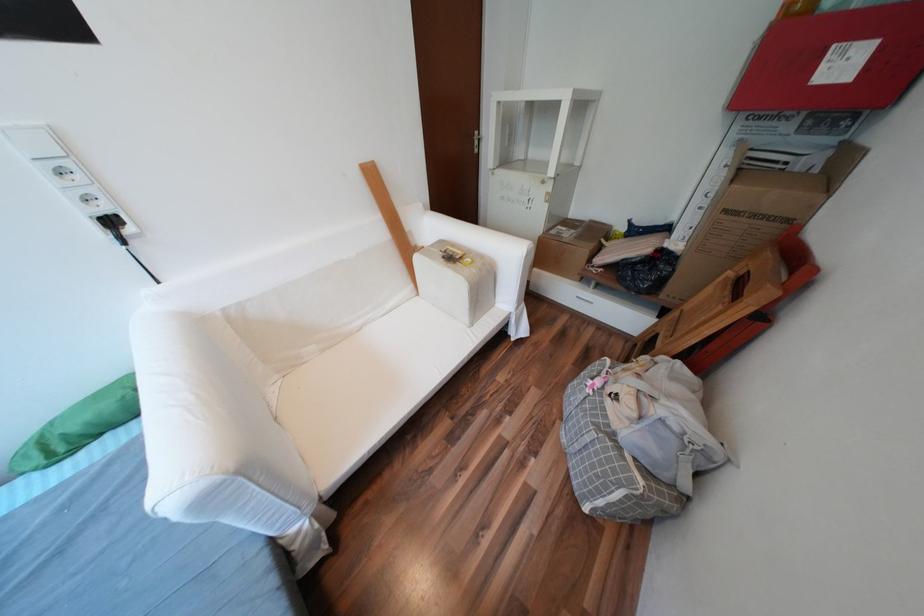
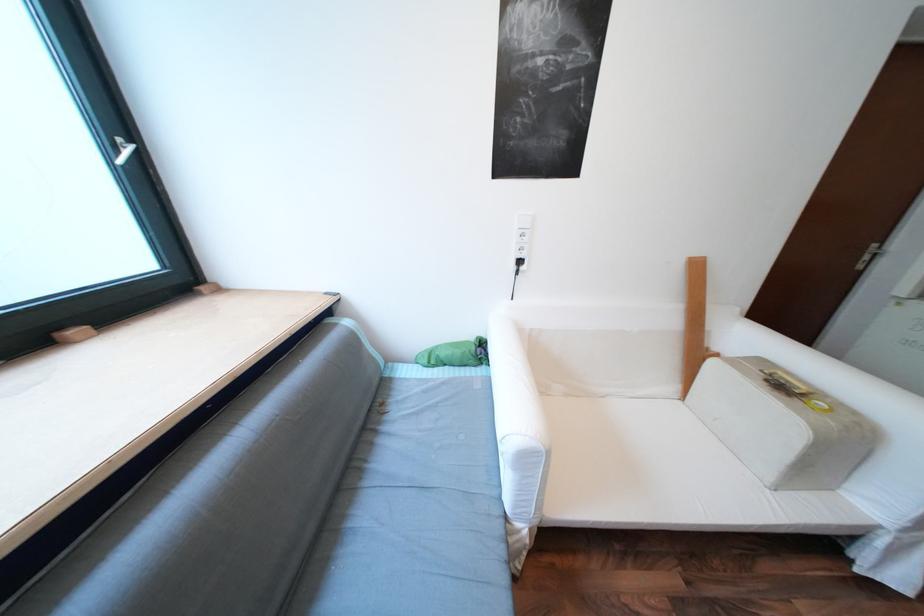
Question: I am providing you with two images of the same scene from different viewpoints. Please identify which objects are invisible in image2.

Choices:
 (A) white window handle
 (B) white sofa armrest
 (C) black wall plug
 (D) none of these

Answer: (D)